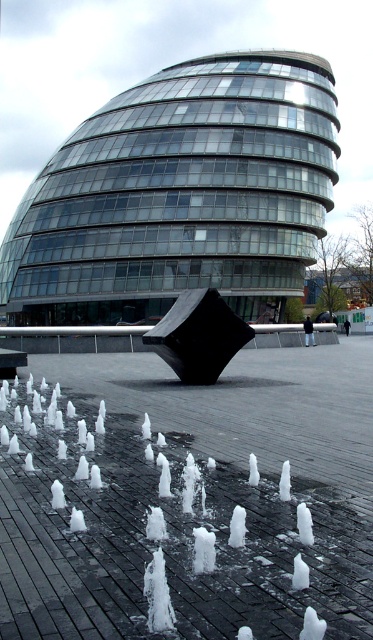
Question: Does transparent glass building at center appear over black polished cube at center?

Choices:
 (A) no
 (B) yes

Answer: (B)

Question: Which object appears closest to the camera in this image?

Choices:
 (A) transparent glass building at center
 (B) black polished cube at center

Answer: (B)

Question: Among these points, which one is farthest from the camera?

Choices:
 (A) (155, 342)
 (B) (98, 196)

Answer: (B)

Question: Can you confirm if transparent glass building at center is positioned to the left of black polished cube at center?

Choices:
 (A) yes
 (B) no

Answer: (A)

Question: Does transparent glass building at center come in front of black polished cube at center?

Choices:
 (A) yes
 (B) no

Answer: (B)